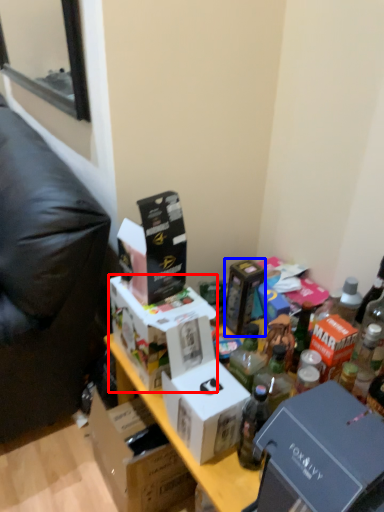
Question: Which of the following is the farthest to the observer, box (highlighted by a red box) or box (highlighted by a blue box)?

Choices:
 (A) box
 (B) box

Answer: (B)